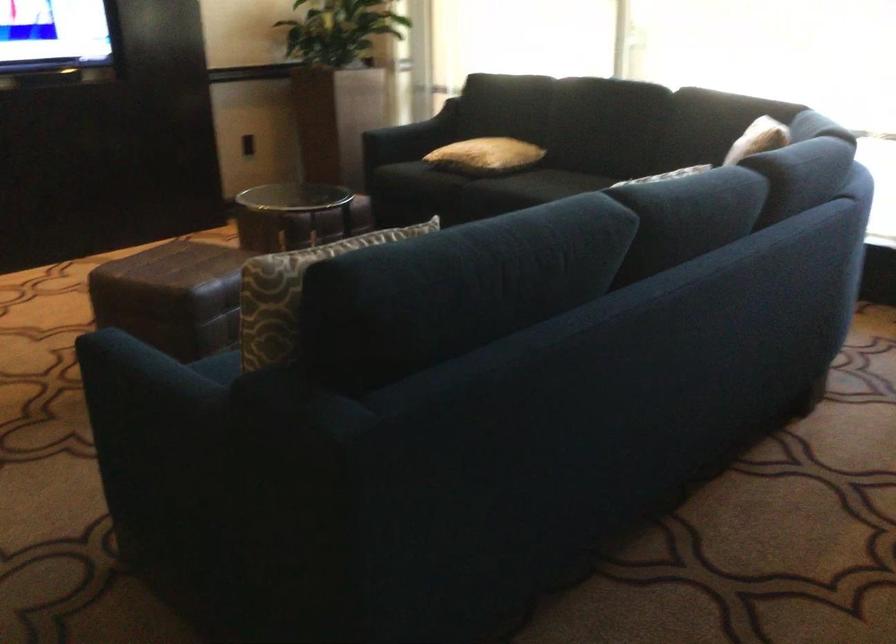
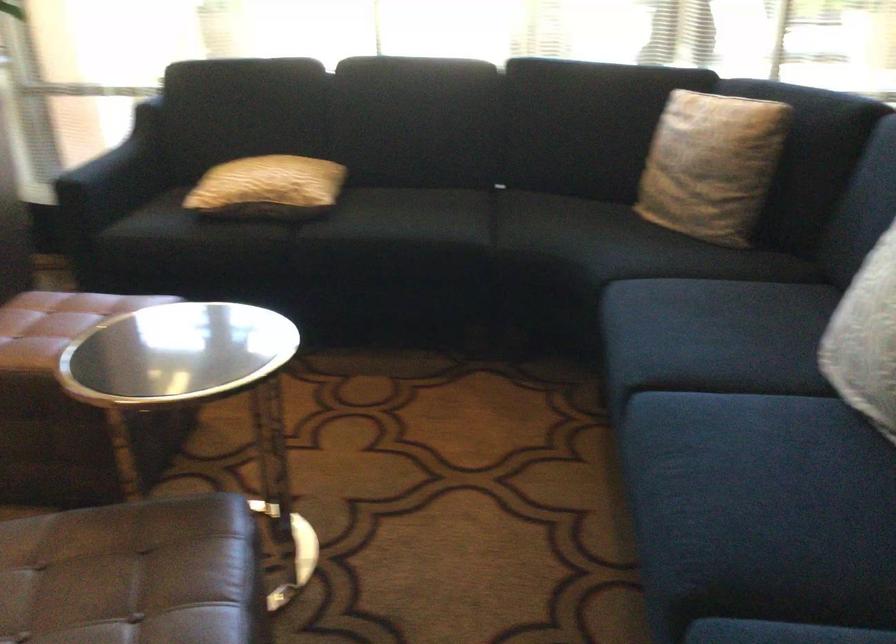
Locate, in the second image, the point that corresponds to pixel 402 137 in the first image.

(115, 176)